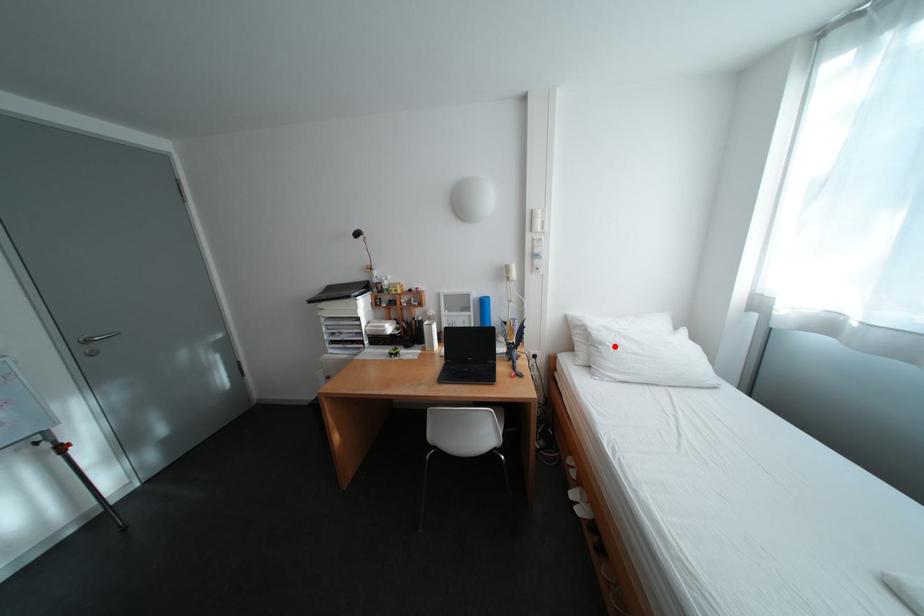
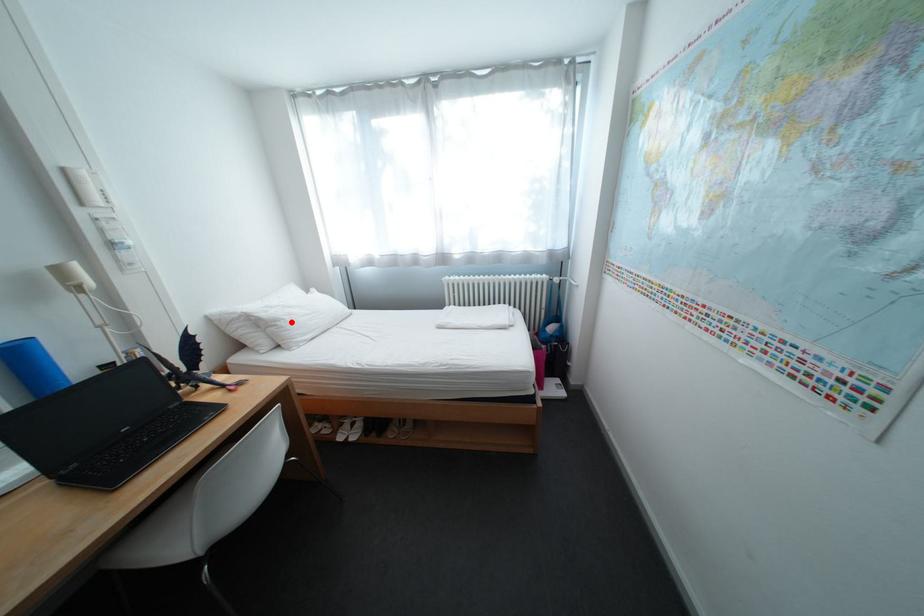
I am providing you with two images of the same scene from different viewpoints. A red point is marked on the first image and another point is marked on the second image. Do the highlighted points in image1 and image2 indicate the same real-world spot?

Yes